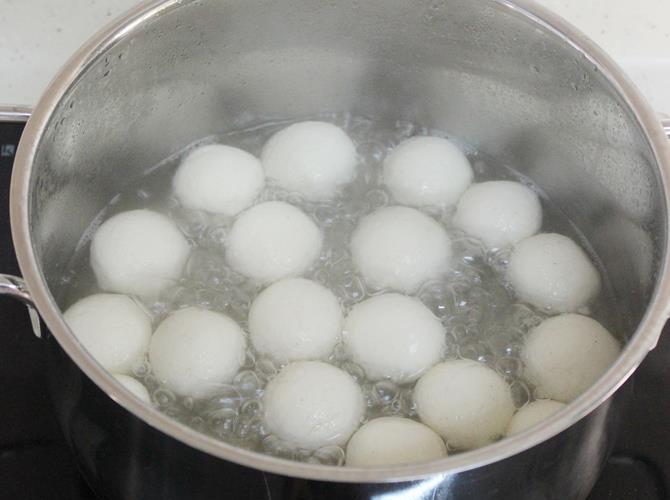
Locate an element on the screen. silver pan is located at coordinates (165, 465).